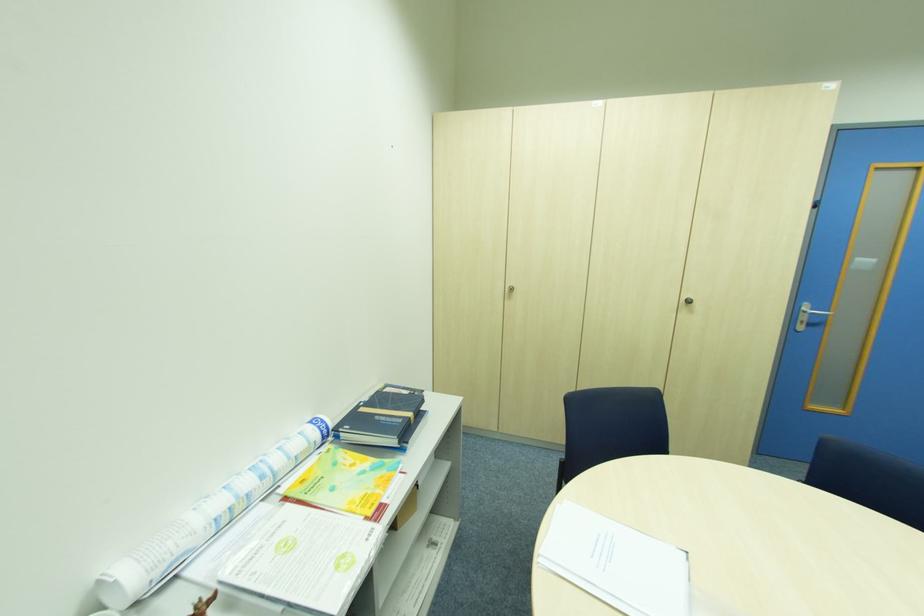
The location [204,520] corresponds to which object?

It refers to a rolled up paper.